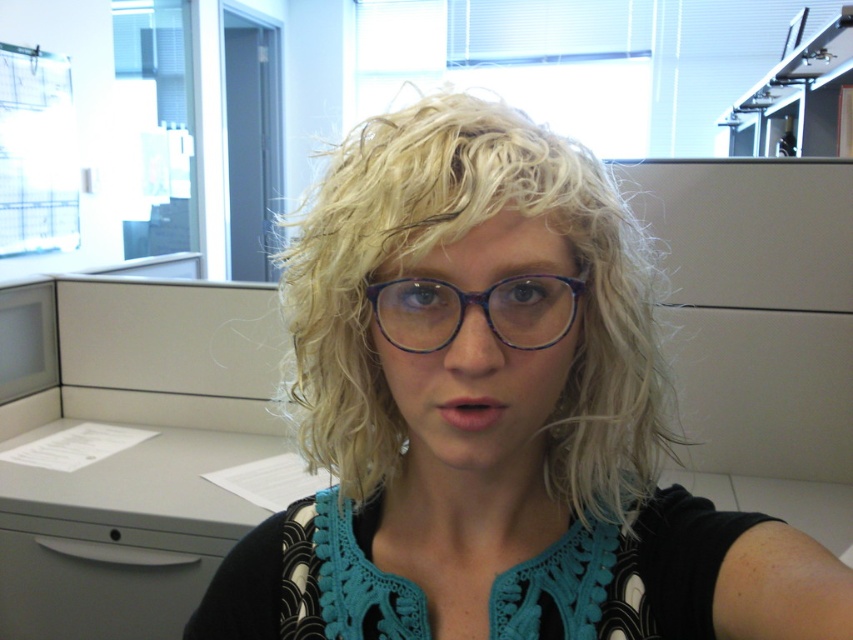
Between blonde hair at center and gray plastic file cabinet at left, which one is positioned lower?

gray plastic file cabinet at left is lower down.

Does blonde hair at center have a larger size compared to gray plastic file cabinet at left?

No.

Between point (651, 429) and point (102, 337), which one is positioned in front?

Point (651, 429) is more forward.

Identify the location of blonde hair at center. The width and height of the screenshot is (853, 640). (492, 417).

Between blonde hair at center and purple acetate glasses at center, which one has more height?

With more height is blonde hair at center.

You are a GUI agent. You are given a task and a screenshot of the screen. Output one action in this format:
    pyautogui.click(x=<x>, y=<y>)
    Task: Click on the blonde hair at center
    The width and height of the screenshot is (853, 640).
    Given the screenshot: What is the action you would take?
    pyautogui.click(x=492, y=417)

Can you confirm if gray plastic file cabinet at left is wider than purple acetate glasses at center?

Correct, the width of gray plastic file cabinet at left exceeds that of purple acetate glasses at center.

The image size is (853, 640). What do you see at coordinates (135, 452) in the screenshot? I see `gray plastic file cabinet at left` at bounding box center [135, 452].

This screenshot has height=640, width=853. I want to click on gray plastic file cabinet at left, so click(x=135, y=452).